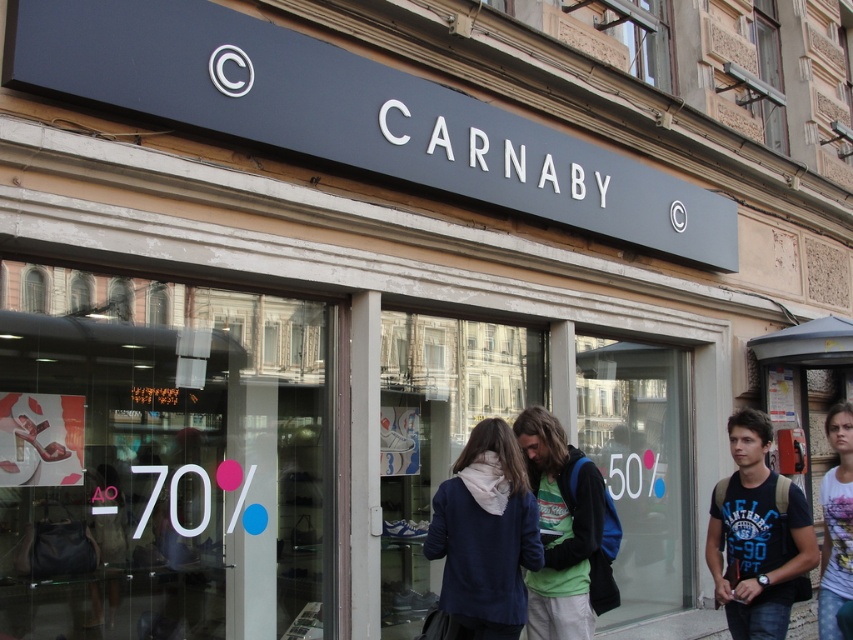
You are a customer browsing the Carnaby store window. You see a navy blue sweater at center and a green fleece jacket at center. Which item is positioned to the left?

The navy blue sweater at center is positioned to the left of the green fleece jacket at center.

In the scene shown: You are trying to decide whether to place a new mannequin in the store window. The mannequin requires 1.2 meters of space. You see the navy blue sweater at center and the green fleece jacket at center. Can both items fit side by side in the window if the total available space is 2.5 meters?

The navy blue sweater at center is wider than the green fleece jacket at center. Since the sweater is larger in width, adding both would require more than 2.5 meters. However, without exact measurements, we can only confirm that their combined width must be less than or equal to 2.5 meters. The question states the sweater is wider, but not by how much. Thus, it is uncertain if they fit together.